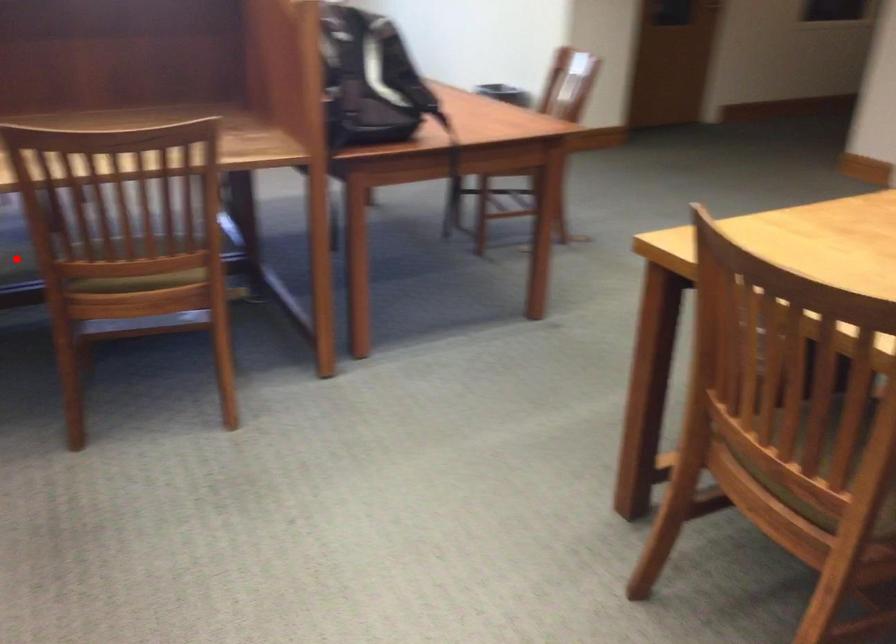
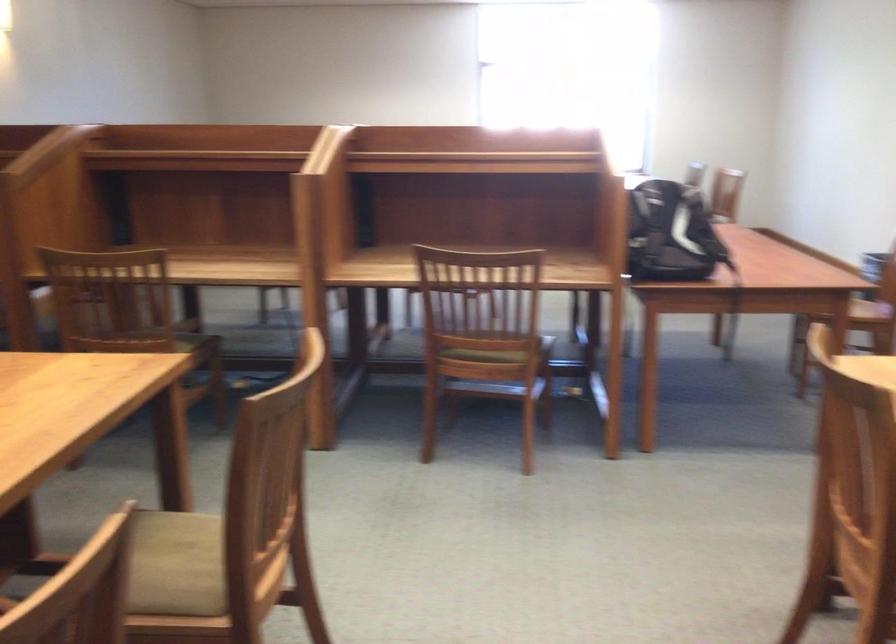
Question: I am providing you with two images of the same scene from different viewpoints. A red point is marked on the first image. Can you still see the location of the red point in image 2?

Choices:
 (A) Yes
 (B) No

Answer: (B)